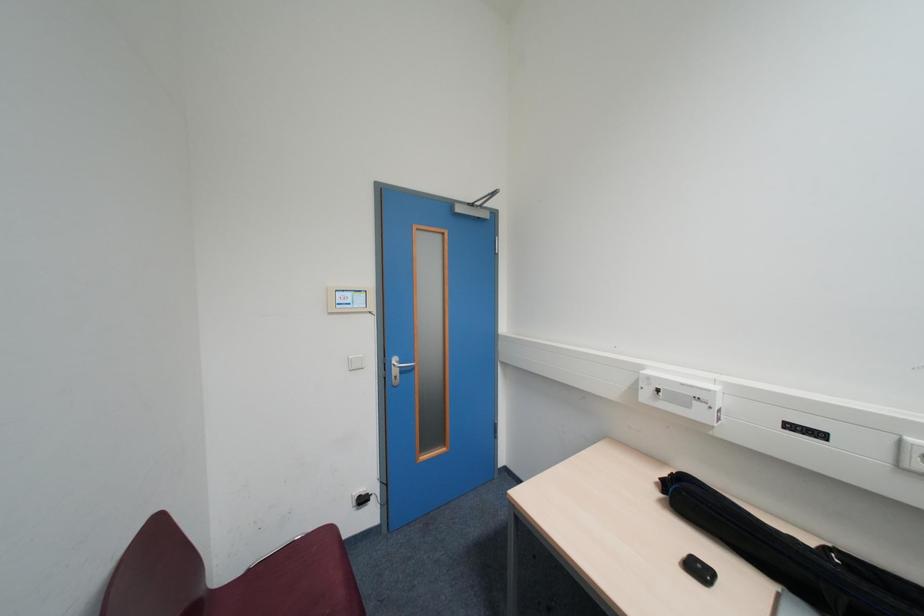
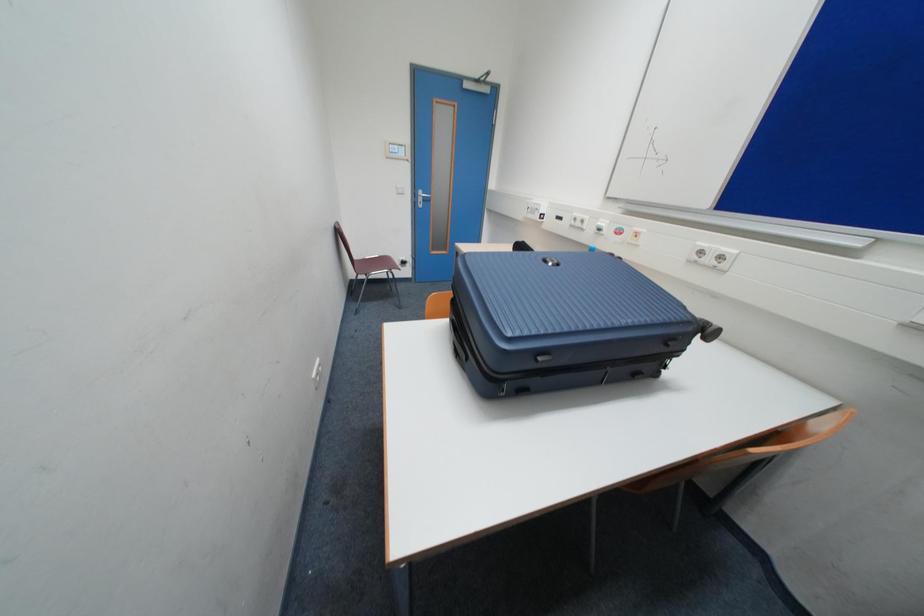
What movement of the cameraman would produce the second image?

The cameraman moved toward right, backward.